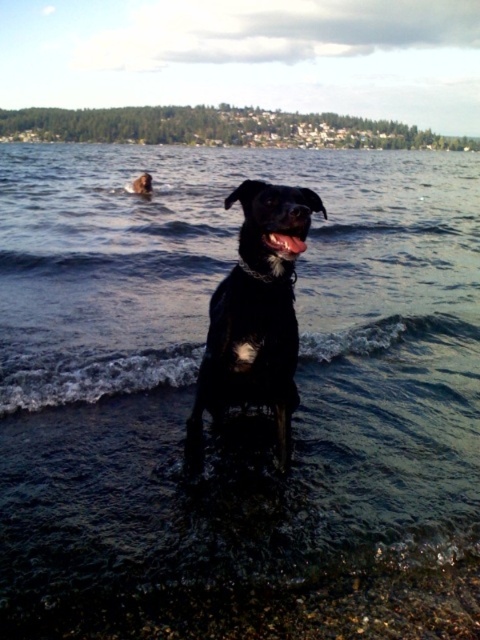
Between smooth pebbles at lower center and shiny black dog at center, which one has more height?

Standing taller between the two is shiny black dog at center.

Measure the distance between smooth pebbles at lower center and camera.

They are 1.91 meters apart.

Image resolution: width=480 pixels, height=640 pixels. In order to click on smooth pebbles at lower center in this screenshot , I will do `click(278, 602)`.